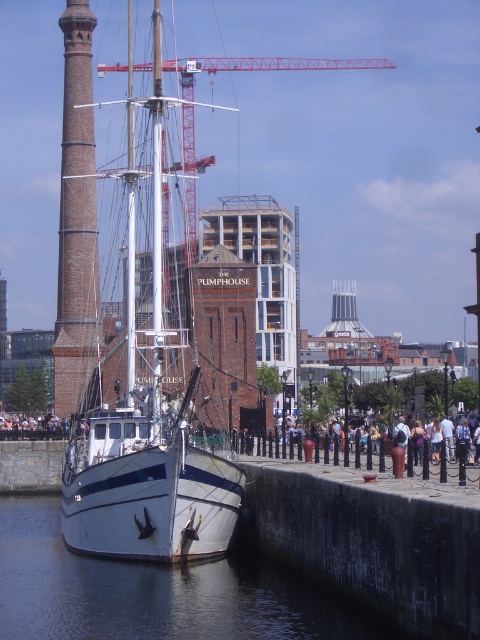
Question: Can you confirm if clear water at boat front is smaller than brick tower at center?

Choices:
 (A) yes
 (B) no

Answer: (A)

Question: Which point appears closest to the camera in this image?

Choices:
 (A) (284, 237)
 (B) (192, 388)

Answer: (B)

Question: Does brick tower at left come behind brick tower at center?

Choices:
 (A) yes
 (B) no

Answer: (B)

Question: Which of the following is the farthest from the observer?

Choices:
 (A) brick tower at center
 (B) white matte sailboat at center

Answer: (A)

Question: Which object appears closest to the camera in this image?

Choices:
 (A) brick tower at center
 (B) clear water at boat front
 (C) brick tower at left

Answer: (B)

Question: Can you confirm if white matte sailboat at center is wider than clear water at boat front?

Choices:
 (A) no
 (B) yes

Answer: (A)